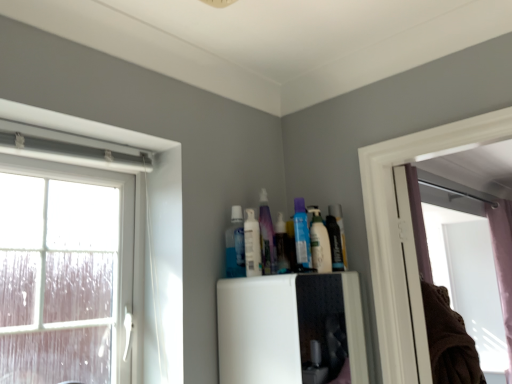
Question: Is brown cotton laundry at right placed right next to translucent purple bottle at upper center, which is the third toiletry in left-to-right order?

Choices:
 (A) yes
 (B) no

Answer: (B)

Question: Is translucent purple bottle at upper center, which is the third toiletry in left-to-right order, surrounded by brown cotton laundry at right?

Choices:
 (A) no
 (B) yes

Answer: (A)

Question: Considering the relative sizes of brown cotton laundry at right and translucent purple bottle at upper center, which is the third toiletry in left-to-right order, in the image provided, is brown cotton laundry at right shorter than translucent purple bottle at upper center, which is the third toiletry in left-to-right order,?

Choices:
 (A) no
 (B) yes

Answer: (A)

Question: Does brown cotton laundry at right have a greater height compared to translucent purple bottle at upper center, acting as the 3th toiletry starting from the right?

Choices:
 (A) yes
 (B) no

Answer: (A)

Question: Can you confirm if brown cotton laundry at right is bigger than translucent purple bottle at upper center, acting as the 3th toiletry starting from the right?

Choices:
 (A) yes
 (B) no

Answer: (A)

Question: Considering the relative positions of brown cotton laundry at right and translucent purple bottle at upper center, which is the third toiletry in left-to-right order, in the image provided, is brown cotton laundry at right in front of translucent purple bottle at upper center, which is the third toiletry in left-to-right order,?

Choices:
 (A) no
 (B) yes

Answer: (B)

Question: Can you confirm if translucent purple bottle at upper center, which is the third toiletry in left-to-right order, is thinner than translucent plastic spray bottle at upper center, which is the 1th toiletry from right to left?

Choices:
 (A) yes
 (B) no

Answer: (A)

Question: Considering the relative sizes of translucent purple bottle at upper center, acting as the 3th toiletry starting from the right, and translucent plastic spray bottle at upper center, which is the fifth toiletry in left-to-right order, in the image provided, is translucent purple bottle at upper center, acting as the 3th toiletry starting from the right, shorter than translucent plastic spray bottle at upper center, which is the fifth toiletry in left-to-right order,?

Choices:
 (A) yes
 (B) no

Answer: (B)

Question: From the image's perspective, is translucent purple bottle at upper center, which is the third toiletry in left-to-right order, above translucent plastic spray bottle at upper center, which is the fifth toiletry in left-to-right order?

Choices:
 (A) yes
 (B) no

Answer: (A)

Question: Can you confirm if translucent purple bottle at upper center, acting as the 3th toiletry starting from the right, is bigger than translucent plastic spray bottle at upper center, which is the 1th toiletry from right to left?

Choices:
 (A) yes
 (B) no

Answer: (A)

Question: From a real-world perspective, is translucent purple bottle at upper center, which is the third toiletry in left-to-right order, positioned over translucent plastic spray bottle at upper center, which is the fifth toiletry in left-to-right order, based on gravity?

Choices:
 (A) no
 (B) yes

Answer: (B)

Question: Is translucent purple bottle at upper center, acting as the 3th toiletry starting from the right, to the left of translucent plastic spray bottle at upper center, which is the fifth toiletry in left-to-right order, from the viewer's perspective?

Choices:
 (A) no
 (B) yes

Answer: (B)

Question: Is the depth of translucent plastic spray bottle at upper center, which is the fifth toiletry in left-to-right order, less than that of clear glass window at left?

Choices:
 (A) yes
 (B) no

Answer: (B)